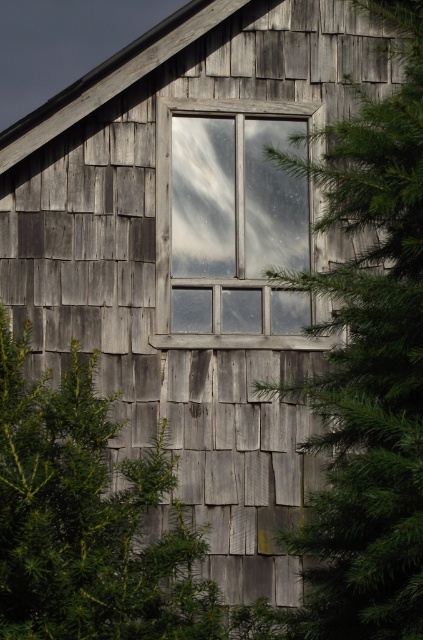
Where is `green textured pine tree at center`? The height and width of the screenshot is (640, 423). green textured pine tree at center is located at coordinates (368, 365).

Between point (392, 205) and point (178, 189), which one is positioned in front?

Point (392, 205)

Between point (332, 125) and point (200, 109), which one is positioned behind?

The point (200, 109) is more distant.

I want to click on green textured pine tree at center, so click(368, 365).